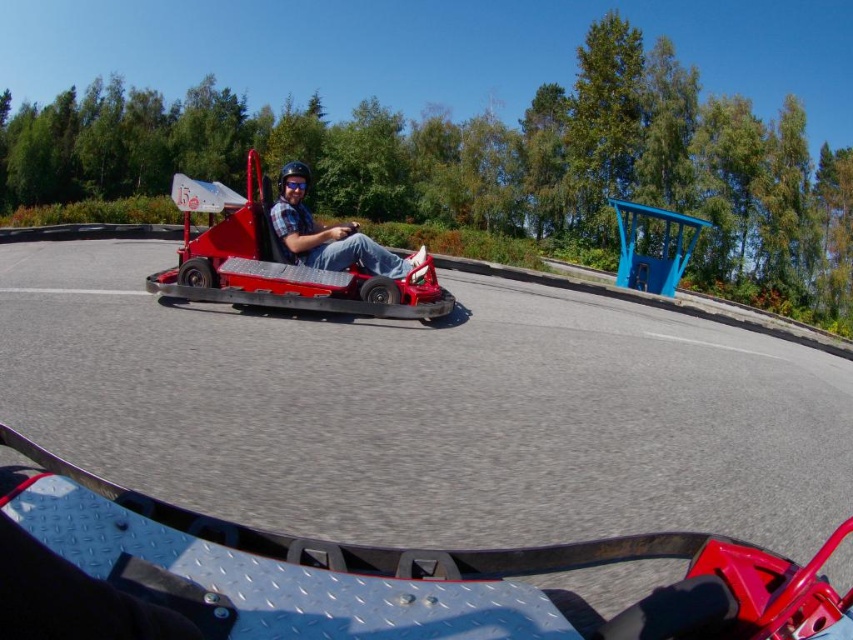
Question: Which point is farther to the camera?

Choices:
 (A) (265, 636)
 (B) (282, 244)
 (C) (289, 173)

Answer: (C)

Question: Among these objects, which one is farthest from the camera?

Choices:
 (A) matte plastic go-kart at center
 (B) smooth asphalt race track at center
 (C) shiny red go-kart at center
 (D) blue matte goggles at center

Answer: (B)

Question: Which point is farther to the camera?

Choices:
 (A) smooth asphalt race track at center
 (B) blue matte goggles at center
 (C) shiny red go-kart at center
 (D) matte plastic go-kart at center

Answer: (A)

Question: Is shiny red go-kart at center bigger than blue matte goggles at center?

Choices:
 (A) yes
 (B) no

Answer: (A)

Question: Does shiny red go-kart at center have a smaller size compared to matte plastic go-kart at center?

Choices:
 (A) yes
 (B) no

Answer: (B)

Question: Is smooth asphalt race track at center wider than matte plastic go-kart at center?

Choices:
 (A) yes
 (B) no

Answer: (B)